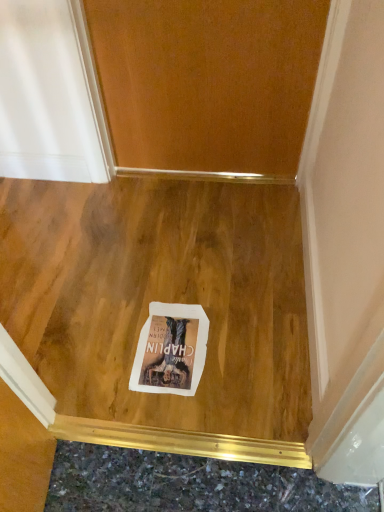
Question: From a real-world perspective, does wooden door at center stand above white paper postcard at center?

Choices:
 (A) yes
 (B) no

Answer: (A)

Question: Can you confirm if wooden door at center is taller than white paper postcard at center?

Choices:
 (A) no
 (B) yes

Answer: (B)

Question: Is wooden door at center not within white paper postcard at center?

Choices:
 (A) yes
 (B) no

Answer: (A)

Question: Can you confirm if wooden door at center is thinner than white paper postcard at center?

Choices:
 (A) yes
 (B) no

Answer: (A)

Question: Does wooden door at center have a larger size compared to white paper postcard at center?

Choices:
 (A) no
 (B) yes

Answer: (B)

Question: Considering the positions of wooden door at center and wooden floor at center in the image, is wooden door at center wider or thinner than wooden floor at center?

Choices:
 (A) wide
 (B) thin

Answer: (B)

Question: From a real-world perspective, is wooden door at center physically located above or below wooden floor at center?

Choices:
 (A) above
 (B) below

Answer: (A)

Question: Would you say wooden door at center is to the left or to the right of wooden floor at center in the picture?

Choices:
 (A) left
 (B) right

Answer: (B)

Question: From the image's perspective, is wooden door at center above or below wooden floor at center?

Choices:
 (A) below
 (B) above

Answer: (B)

Question: Considering the positions of wooden floor at center and white paper postcard at center in the image, is wooden floor at center taller or shorter than white paper postcard at center?

Choices:
 (A) tall
 (B) short

Answer: (A)

Question: Is wooden floor at center to the left or to the right of white paper postcard at center in the image?

Choices:
 (A) right
 (B) left

Answer: (B)

Question: From a real-world perspective, is wooden floor at center positioned above or below white paper postcard at center?

Choices:
 (A) above
 (B) below

Answer: (A)

Question: Relative to white paper postcard at center, is wooden floor at center in front or behind?

Choices:
 (A) front
 (B) behind

Answer: (A)

Question: From the image's perspective, is wooden door at center located above or below white paper postcard at center?

Choices:
 (A) above
 (B) below

Answer: (A)

Question: Considering the positions of point (125, 114) and point (167, 324), is point (125, 114) closer or farther from the camera than point (167, 324)?

Choices:
 (A) farther
 (B) closer

Answer: (A)